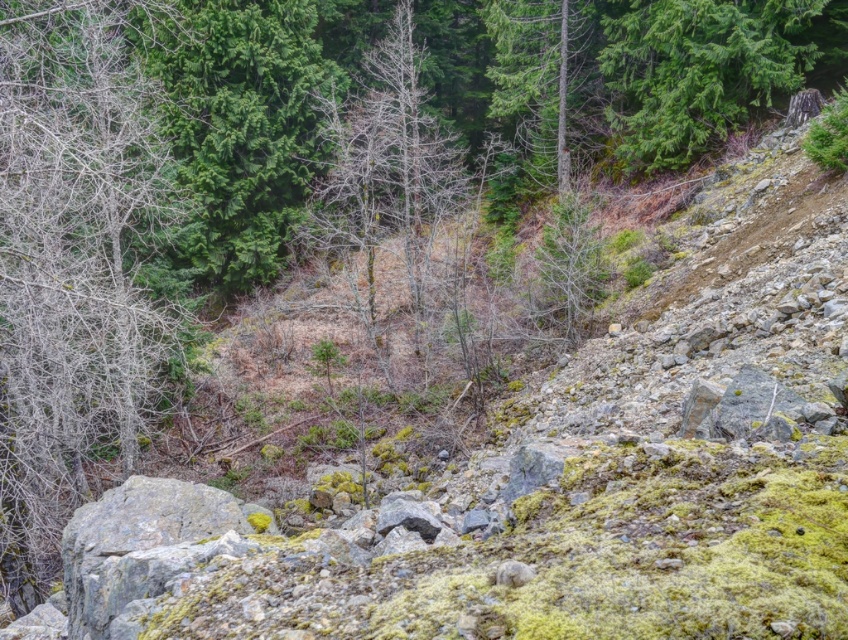
Can you confirm if bare branches at left is positioned above green textured tree at upper right?

No.

Which is behind, point (73, 44) or point (696, 83)?

Point (696, 83)

The height and width of the screenshot is (640, 848). I want to click on bare branches at left, so click(77, 268).